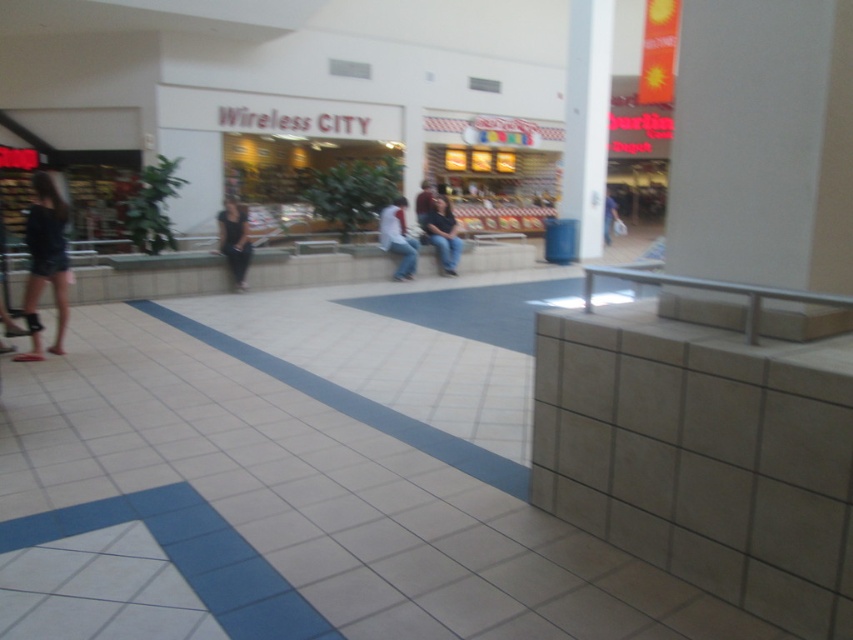
You are a store manager checking the visibility of clothing items in your mall. You notice the dark blue shorts at left and the matte white shirt at center. Which clothing item appears smaller in the image?

The dark blue shorts at left appears smaller than the matte white shirt at center in the image.

You are standing at the entrance of the shopping mall and want to locate the dark gray pants at center. According to the coordinates provided, in which direction should you move to find them?

The dark gray pants at center are located at coordinates point (234, 241). Since the coordinate system typically starts from the bottom left corner, moving towards the center of the image would be the correct direction.